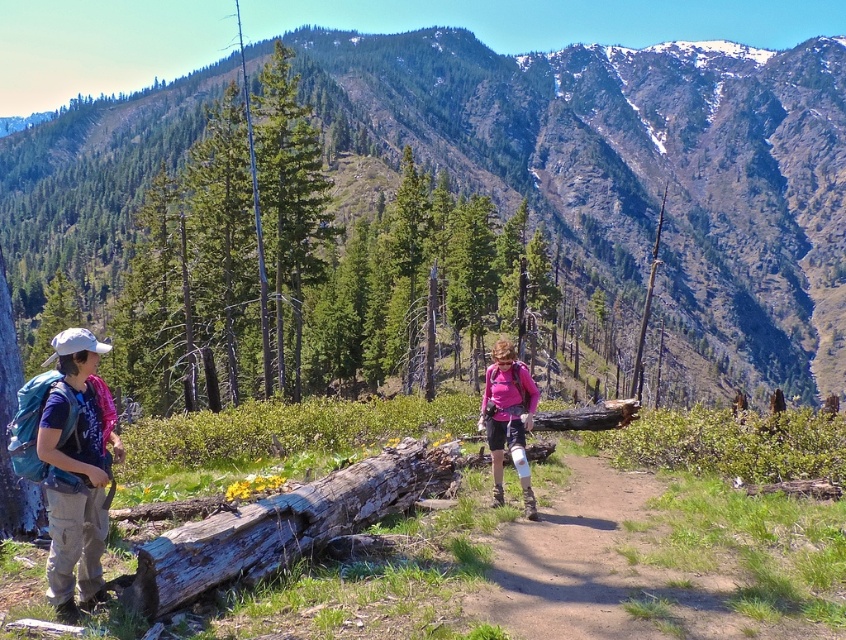
You are a hiker planning to take a photo of the green forested mountain at upper center and the matte blue backpack at left. Which object should you focus on first if you want both to be in clear view?

The green forested mountain at upper center is larger in size compared to the matte blue backpack at left, so you should focus on the green forested mountain at upper center first to ensure both are in clear view.

You are a hiker looking at the scene. You see a matte blue shirt at left and a matte blue backpack at left. Which one is positioned more to the right side?

The matte blue shirt at left is positioned more to the right side than the matte blue backpack at left.

You are a hiker planning to walk from the starting point to the pink fabric at center. There is a weathered wood log at center in your path. Can you step over the log without detouring around it?

The weathered wood log at center is closer to the viewer than the pink fabric at center, so you can step over the log on your way to the pink fabric at center.